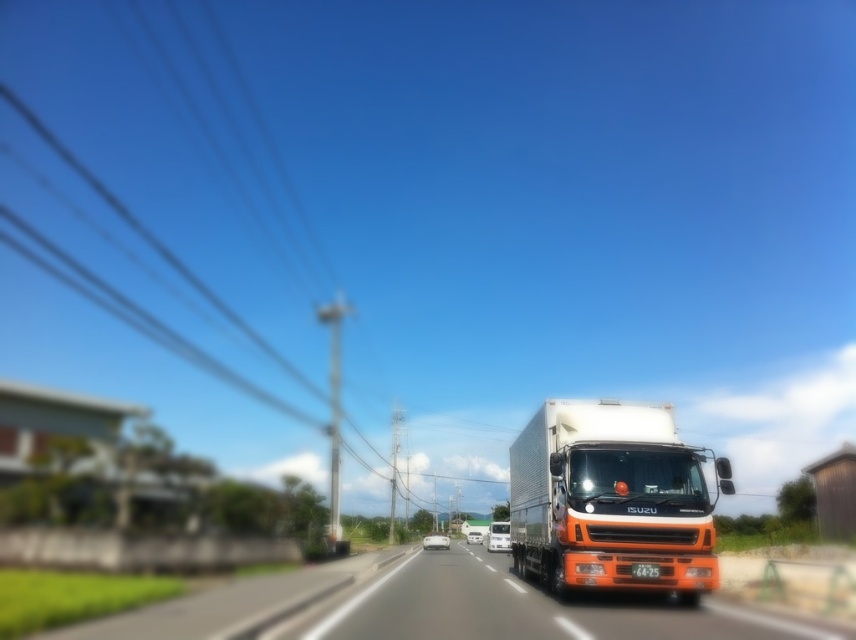
Is orange matte truck at center smaller than orange matte trailer truck at center?

Actually, orange matte truck at center might be larger than orange matte trailer truck at center.

Find the location of a particular element. The image size is (856, 640). orange matte truck at center is located at coordinates (426, 605).